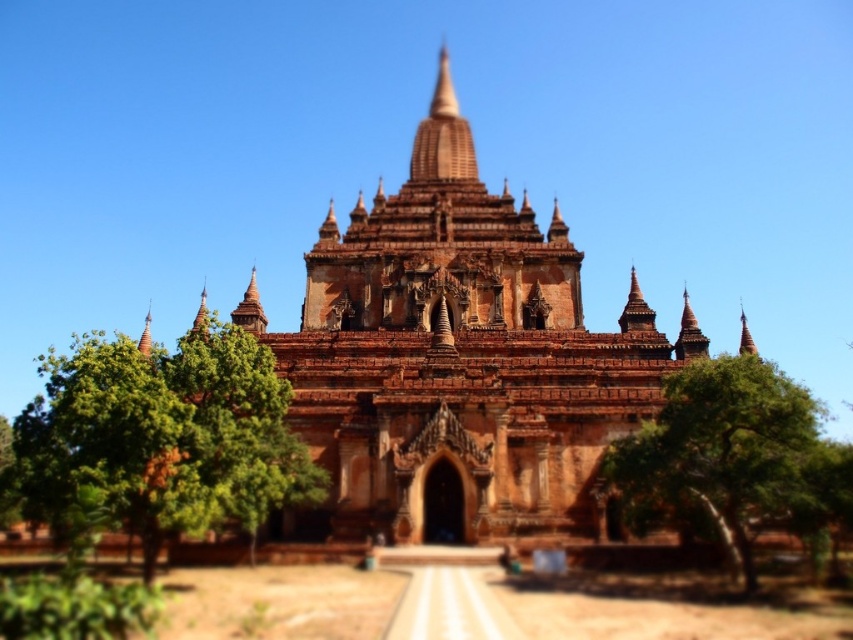
Question: Which is farther from the brown textured pagoda at center?

Choices:
 (A) green leafy tree at lower right
 (B) brown stone temple at center
 (C) green leafy tree at left

Answer: (C)

Question: Is brown textured pagoda at center to the right of green leafy tree at lower right from the viewer's perspective?

Choices:
 (A) no
 (B) yes

Answer: (A)

Question: Estimate the real-world distances between objects in this image. Which object is farther from the brown stone temple at center?

Choices:
 (A) brown textured pagoda at center
 (B) green leafy tree at left

Answer: (B)

Question: In this image, where is green leafy tree at left located relative to brown stone temple at center?

Choices:
 (A) above
 (B) below

Answer: (B)

Question: Which object is the closest to the brown textured pagoda at center?

Choices:
 (A) green leafy tree at left
 (B) green leafy tree at lower right

Answer: (B)

Question: Is brown textured pagoda at center above green leafy tree at left?

Choices:
 (A) yes
 (B) no

Answer: (A)